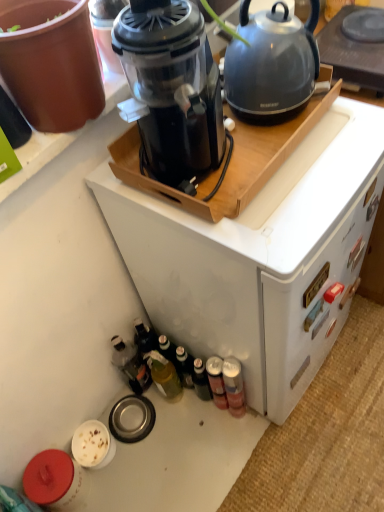
This screenshot has height=512, width=384. In order to click on vacant region in front of metallic gray kettle at upper right in this screenshot , I will do `click(331, 160)`.